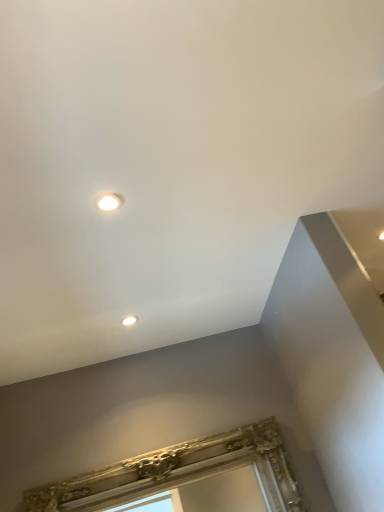
Question: Is matte white droplight at upper center, which is the first droplight from top to bottom, at the back of gold ornate frame at lower center?

Choices:
 (A) yes
 (B) no

Answer: (B)

Question: Considering the relative positions of gold ornate frame at lower center and matte white droplight at upper center, which appears as the 2th droplight when viewed from the back, in the image provided, is gold ornate frame at lower center to the left of matte white droplight at upper center, which appears as the 2th droplight when viewed from the back, from the viewer's perspective?

Choices:
 (A) no
 (B) yes

Answer: (A)

Question: Is gold ornate frame at lower center positioned in front of matte white droplight at upper center, acting as the first droplight starting from the front?

Choices:
 (A) yes
 (B) no

Answer: (B)

Question: Does gold ornate frame at lower center have a lesser height compared to matte white droplight at upper center, which is the second droplight from bottom to top?

Choices:
 (A) yes
 (B) no

Answer: (B)

Question: Can you confirm if gold ornate frame at lower center is thinner than matte white droplight at upper center, which appears as the 2th droplight when viewed from the back?

Choices:
 (A) yes
 (B) no

Answer: (B)

Question: From the image's perspective, would you say gold ornate frame at lower center is shown under matte white droplight at upper center, which is the second droplight from bottom to top?

Choices:
 (A) no
 (B) yes

Answer: (B)

Question: From a real-world perspective, is matte white droplight at upper center, which is the first droplight from bottom to top, beneath matte white droplight at upper center, which is the second droplight from bottom to top?

Choices:
 (A) yes
 (B) no

Answer: (B)

Question: Does matte white droplight at upper center, acting as the 1th droplight starting from the back, have a lesser height compared to matte white droplight at upper center, which appears as the 2th droplight when viewed from the back?

Choices:
 (A) no
 (B) yes

Answer: (B)

Question: Can you confirm if matte white droplight at upper center, acting as the 1th droplight starting from the back, is smaller than matte white droplight at upper center, which appears as the 2th droplight when viewed from the back?

Choices:
 (A) yes
 (B) no

Answer: (A)

Question: Considering the relative sizes of matte white droplight at upper center, the 2th droplight from the top, and matte white droplight at upper center, which appears as the 2th droplight when viewed from the back, in the image provided, is matte white droplight at upper center, the 2th droplight from the top, bigger than matte white droplight at upper center, which appears as the 2th droplight when viewed from the back,?

Choices:
 (A) no
 (B) yes

Answer: (A)

Question: Is matte white droplight at upper center, acting as the 1th droplight starting from the back, not within matte white droplight at upper center, which is the first droplight from top to bottom?

Choices:
 (A) yes
 (B) no

Answer: (A)

Question: Can you confirm if matte white droplight at upper center, which is the first droplight from bottom to top, is wider than matte white droplight at upper center, which is the second droplight from bottom to top?

Choices:
 (A) yes
 (B) no

Answer: (A)

Question: Is matte white droplight at upper center, the 2th droplight from the top, to the right of gold ornate frame at lower center from the viewer's perspective?

Choices:
 (A) no
 (B) yes

Answer: (A)